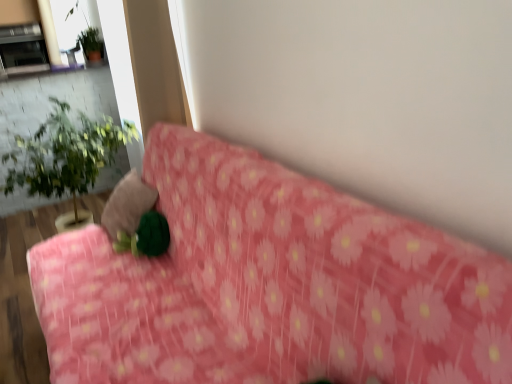
Question: Considering their positions, is metallic silver fireplace at upper left located in front of or behind pink floral fabric at center?

Choices:
 (A) front
 (B) behind

Answer: (B)

Question: From their relative heights in the image, would you say metallic silver fireplace at upper left is taller or shorter than pink floral fabric at center?

Choices:
 (A) tall
 (B) short

Answer: (B)

Question: Which object is positioned farthest from the green leafy plant at left?

Choices:
 (A) velvety green pillow at center
 (B) metallic silver fireplace at upper left
 (C) pink floral fabric at center
 (D) green matte plant at upper left

Answer: (C)

Question: Which is farther from the green matte plant at upper left?

Choices:
 (A) green leafy plant at left
 (B) metallic silver fireplace at upper left
 (C) velvety green pillow at center
 (D) pink floral fabric at center

Answer: (D)